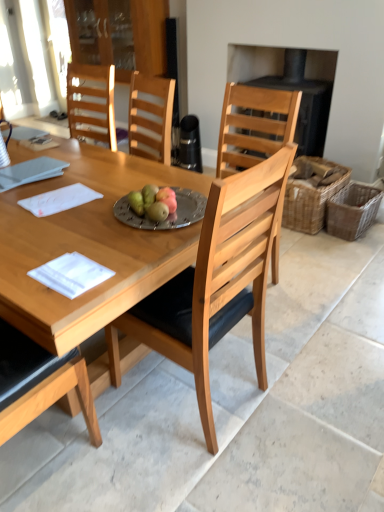
The width and height of the screenshot is (384, 512). Identify the location of unoccupied area in front of silver metallic plate at center. (136, 240).